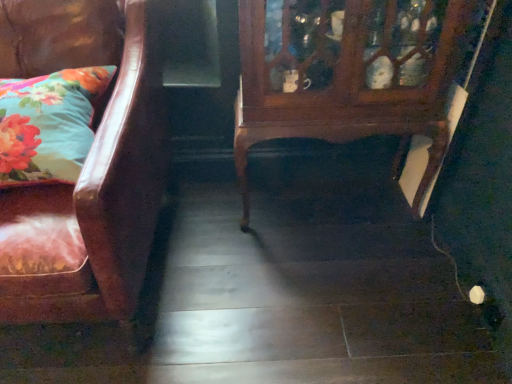
Question: From the image's perspective, is leather couch at left above or below floral fabric pillow at left?

Choices:
 (A) above
 (B) below

Answer: (B)

Question: Is leather couch at left situated inside floral fabric pillow at left or outside?

Choices:
 (A) inside
 (B) outside

Answer: (B)

Question: Considering the real-world distances, which object is closest to the floral fabric pillow at left?

Choices:
 (A) leather couch at left
 (B) wooden cabinet at center

Answer: (A)

Question: Which object is positioned farthest from the floral fabric pillow at left?

Choices:
 (A) wooden cabinet at center
 (B) leather couch at left

Answer: (A)